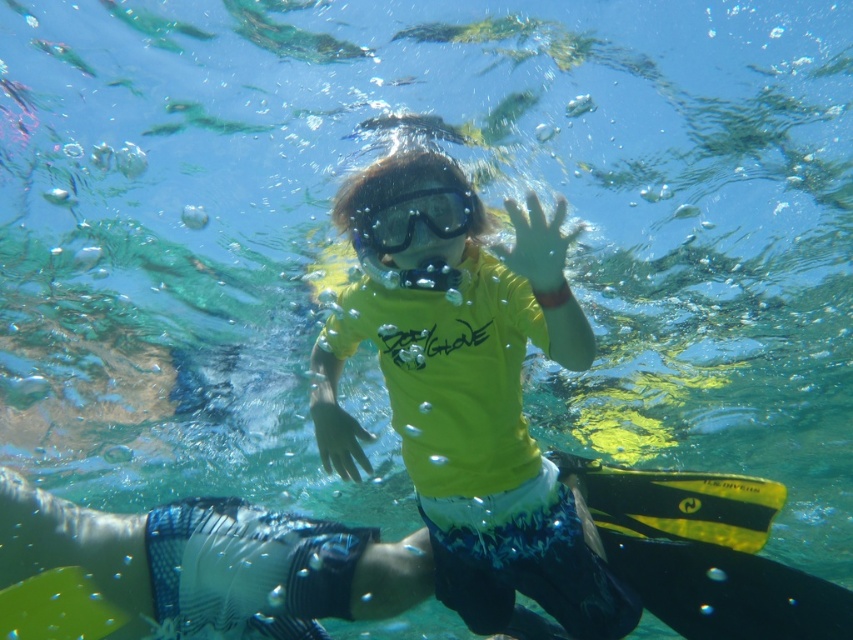
Question: Which point appears closest to the camera in this image?

Choices:
 (A) (347, 305)
 (B) (415, 209)

Answer: (B)

Question: Can you confirm if yellow matte shirt at center is wider than transparent plastic goggles at center?

Choices:
 (A) yes
 (B) no

Answer: (A)

Question: Is yellow matte shirt at center positioned behind transparent plastic goggles at center?

Choices:
 (A) no
 (B) yes

Answer: (A)

Question: Which point is farther to the camera?

Choices:
 (A) (387, 211)
 (B) (596, 611)

Answer: (B)

Question: Is yellow matte shirt at center to the right of transparent plastic goggles at center from the viewer's perspective?

Choices:
 (A) yes
 (B) no

Answer: (A)

Question: Which point is closer to the camera?

Choices:
 (A) transparent plastic goggles at center
 (B) yellow matte shirt at center

Answer: (B)